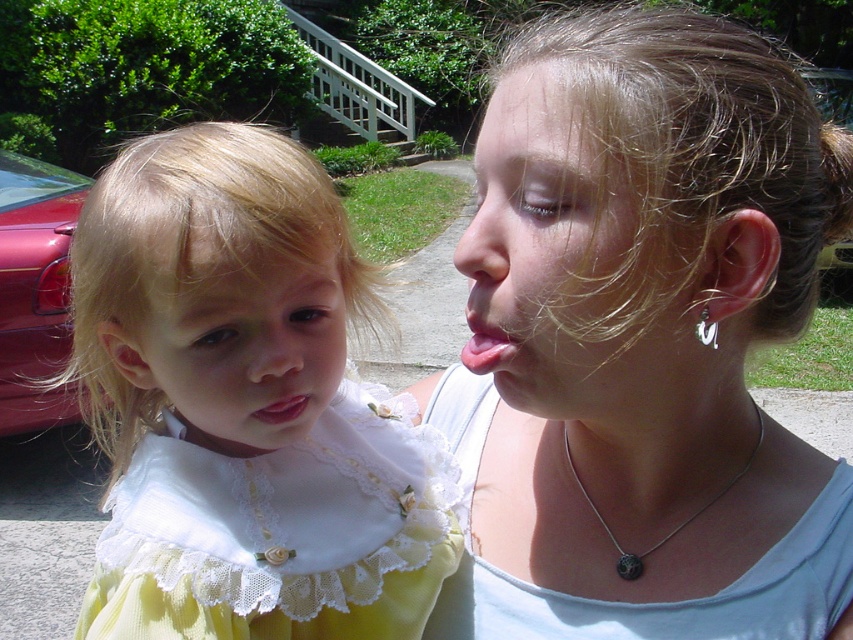
You are standing in the residential area with greenery and stairs. You see the satin white blouse at upper right and the yellow lace dress at center. Which one is closer to you?

The satin white blouse at upper right is in front of the yellow lace dress at center, so it is closer to you.

You are standing in the residential area with greenery and stairs. You need to locate the satin white blouse at upper right. According to the coordinates given, where would you look to find it?

The satin white blouse at upper right is located at the 2D coordinates point (643,340).

You are a photographer trying to capture a clear shot of the yellow lace dress at left without the satin white blouse at upper right blocking it. Can you adjust your angle to achieve this?

The satin white blouse at upper right is positioned over the yellow lace dress at left, so adjusting your angle to shoot from below or the side might allow you to capture the yellow lace dress at left without obstruction.